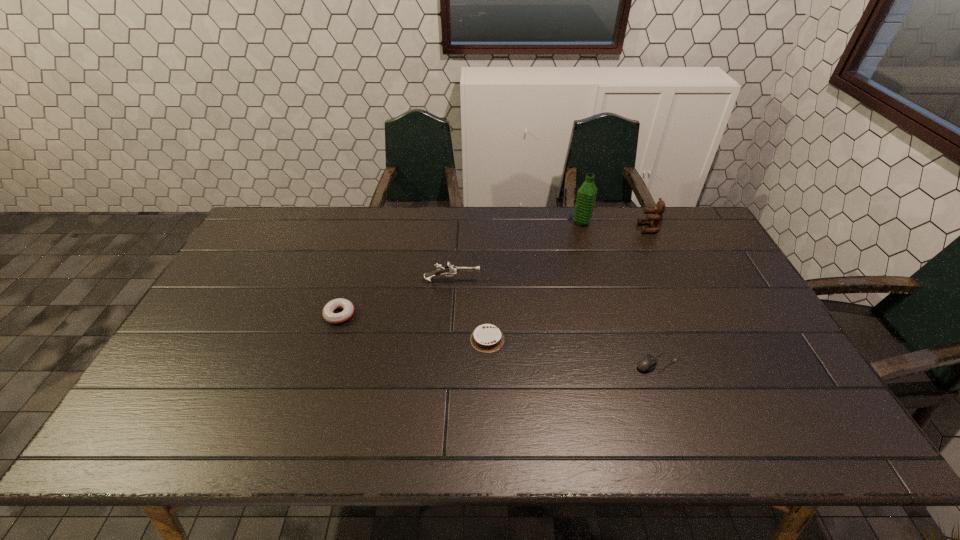
Find the location of `free space that satisfies the following two spatial constraints: 1. aimed along the barrel of the fourth shortest object; 2. on the left side of the chocolate cake`. free space that satisfies the following two spatial constraints: 1. aimed along the barrel of the fourth shortest object; 2. on the left side of the chocolate cake is located at coordinates (448, 339).

The height and width of the screenshot is (540, 960). What are the coordinates of `vacant area that satisfies the following two spatial constraints: 1. aimed along the barrel of the third farthest object; 2. on the front side of the doughnut` in the screenshot? It's located at (449, 314).